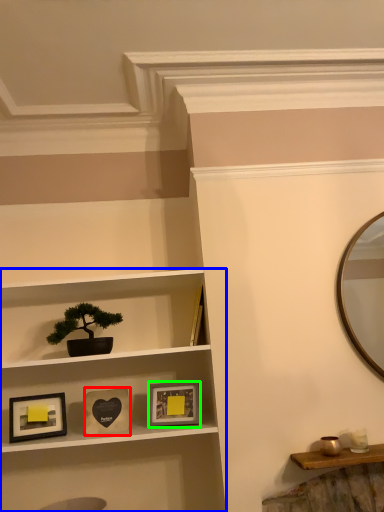
Question: Estimate the real-world distances between objects in this image. Which object is farther from picture frame (highlighted by a red box), shelf (highlighted by a blue box) or picture frame (highlighted by a green box)?

Choices:
 (A) shelf
 (B) picture frame

Answer: (A)